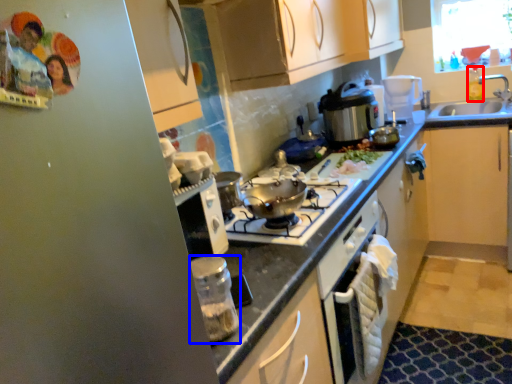
Question: Which object appears closest to the camera in this image, bottle (highlighted by a red box) or kitchen appliance (highlighted by a blue box)?

Choices:
 (A) bottle
 (B) kitchen appliance

Answer: (B)